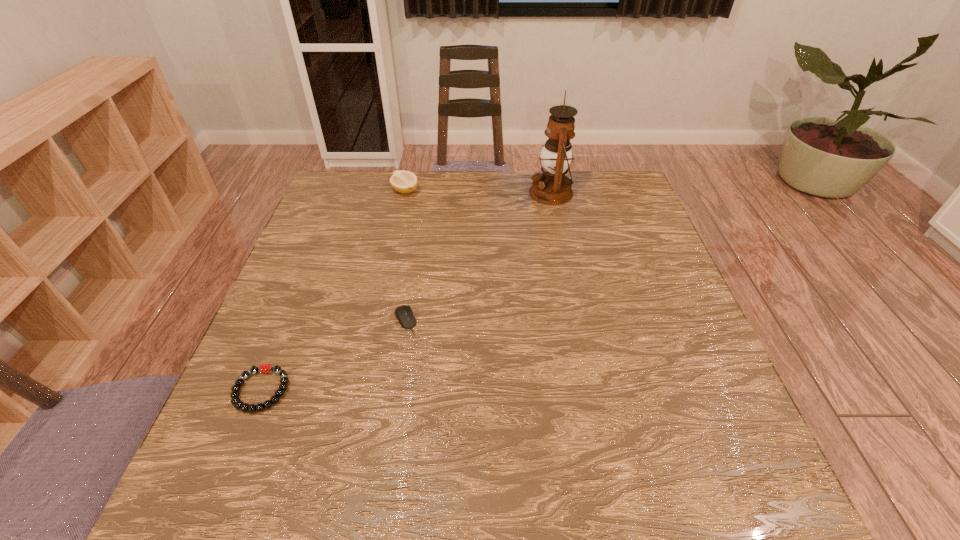
Image resolution: width=960 pixels, height=540 pixels. What are the coordinates of `vacant space located 0.120m on the right of the lemon` in the screenshot? It's located at (457, 191).

Find the location of `blank space located on the left of the second shortest object`. blank space located on the left of the second shortest object is located at coordinates (304, 320).

This screenshot has width=960, height=540. What are the coordinates of `vacant region located on the right of the shortest object` in the screenshot? It's located at (329, 390).

Find the location of `lantern that is positioned at the far edge`. lantern that is positioned at the far edge is located at coordinates click(x=552, y=187).

I want to click on lemon present at the far edge, so click(402, 181).

Image resolution: width=960 pixels, height=540 pixels. I want to click on object present at the left edge, so click(x=264, y=368).

The height and width of the screenshot is (540, 960). What are the coordinates of `vacant area at the far edge` in the screenshot? It's located at (383, 184).

You are a GUI agent. You are given a task and a screenshot of the screen. Output one action in this format:
    pyautogui.click(x=<x>, y=<y>)
    Task: Click on the free space at the near edge
    
    Given the screenshot: What is the action you would take?
    point(460,498)

The width and height of the screenshot is (960, 540). I want to click on blank space at the left edge of the desktop, so click(x=311, y=302).

Identify the location of free space at the right edge. The image size is (960, 540). (700, 384).